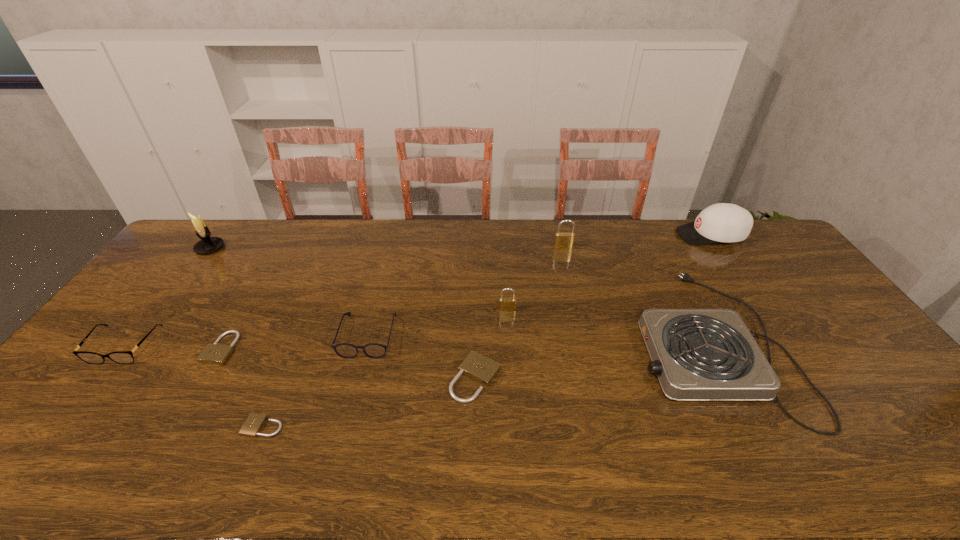
In the image, there is a desktop. Identify the location of vacant area at the left edge. (35, 437).

This screenshot has width=960, height=540. In the image, there is a desktop. Find the location of `free space at the right edge`. free space at the right edge is located at coordinates (769, 292).

Locate an element on the screen. free area in between the rightmost beige padlock and the baseball cap is located at coordinates 593,307.

Find the location of a particular element. Image resolution: width=960 pixels, height=540 pixels. empty space that is in between the left spectacles and the second padlock from left to right is located at coordinates (195, 386).

The height and width of the screenshot is (540, 960). Find the location of `free space between the second tallest padlock and the candle holder`. free space between the second tallest padlock and the candle holder is located at coordinates (358, 279).

This screenshot has height=540, width=960. Find the location of `blank region between the nearest beige padlock and the right spectacles`. blank region between the nearest beige padlock and the right spectacles is located at coordinates (316, 381).

This screenshot has width=960, height=540. I want to click on vacant point located between the fourth shortest padlock and the hotplate, so click(x=609, y=327).

I want to click on free point between the second smallest beige padlock and the fourth object from left to right, so click(243, 387).

Where is `unoccupied area between the tallest object and the second padlock from right to left`? The height and width of the screenshot is (540, 960). unoccupied area between the tallest object and the second padlock from right to left is located at coordinates [x=358, y=279].

This screenshot has width=960, height=540. Find the location of `free space between the left spectacles and the farther brass padlock`. free space between the left spectacles and the farther brass padlock is located at coordinates (345, 297).